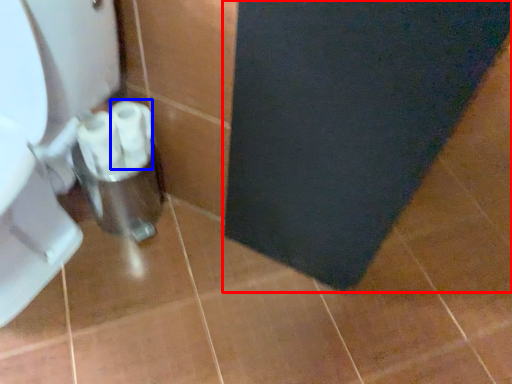
Question: Which object appears farthest to the camera in this image, bath mat (highlighted by a red box) or toilet paper (highlighted by a blue box)?

Choices:
 (A) bath mat
 (B) toilet paper

Answer: (B)